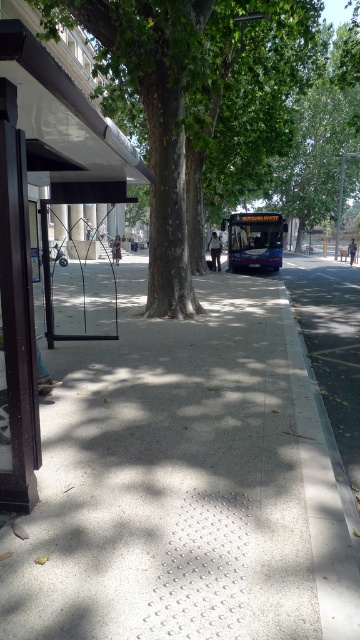
Question: Is green leafy tree at center to the right of blue metallic bus at center from the viewer's perspective?

Choices:
 (A) yes
 (B) no

Answer: (B)

Question: Considering the relative positions of green leafy tree at center and blue metallic bus at center in the image provided, where is green leafy tree at center located with respect to blue metallic bus at center?

Choices:
 (A) above
 (B) below

Answer: (A)

Question: From the image, what is the correct spatial relationship of black matte bus stop at left in relation to blue metallic bus at center?

Choices:
 (A) left
 (B) right

Answer: (A)

Question: Which is farther from the black matte bus stop at left?

Choices:
 (A) gray concrete curb at lower right
 (B) smooth concrete pavement at center
 (C) blue metallic bus at center

Answer: (C)

Question: Which object is closer to the camera taking this photo?

Choices:
 (A) gray concrete curb at lower right
 (B) blue metallic bus at center

Answer: (A)

Question: Which point is closer to the camera?

Choices:
 (A) (275, 458)
 (B) (15, 253)
 (C) (200, 36)

Answer: (B)